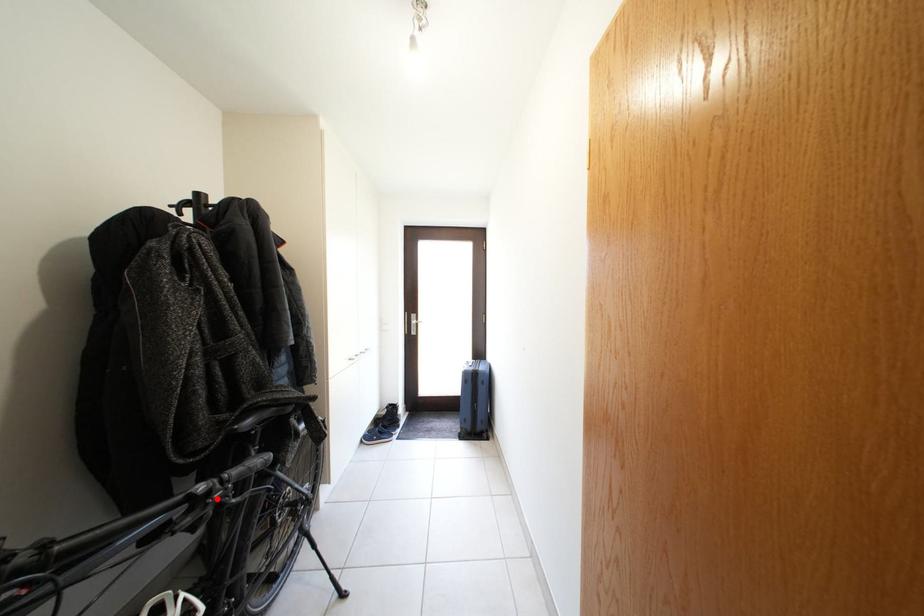
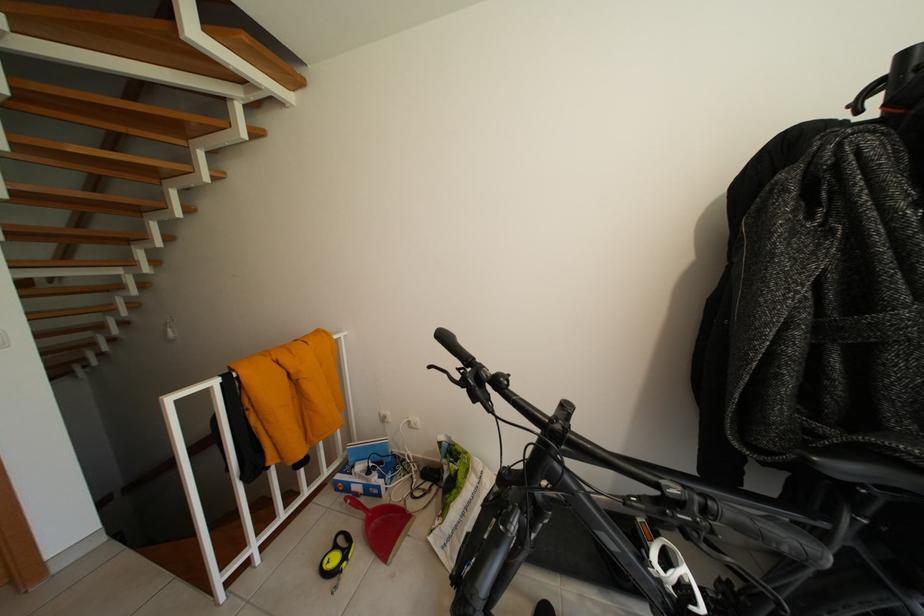
In the second image, find the point that corresponds to the highlighted location in the first image.

(688, 509)